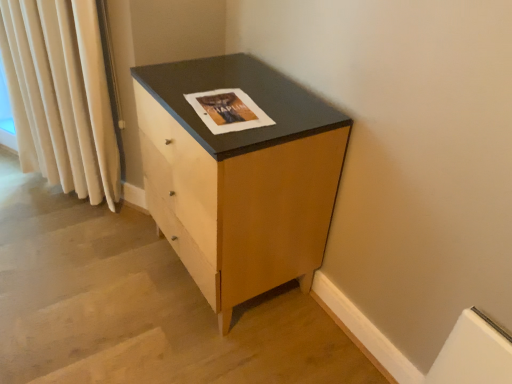
This screenshot has width=512, height=384. I want to click on empty space that is ontop of matte paper magazine at center, so click(223, 101).